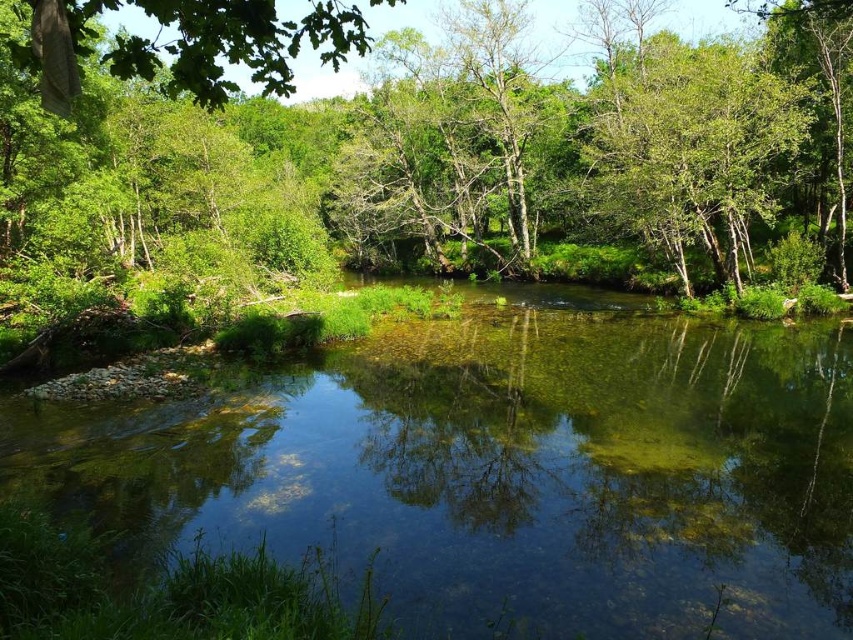
You are standing at the edge of the clear glass river at center and want to reach the green leafy tree at upper right. In which direction should you walk to get there?

You should walk to the right because the clear glass river at center is positioned on the left side of the green leafy tree at upper right, meaning the tree is to the right of the river.